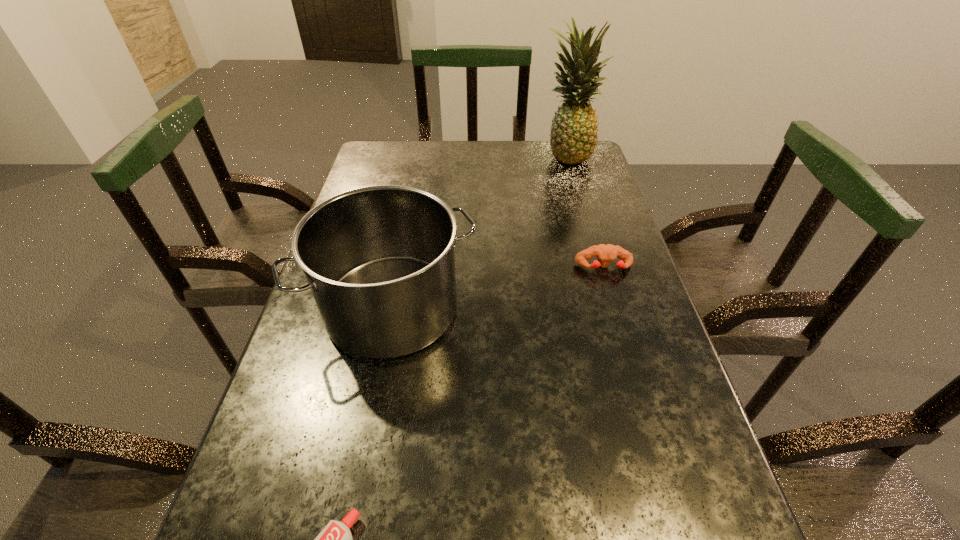
Find the location of a particular element. the tallest object is located at coordinates (573, 137).

Find the location of a particular element. Image resolution: width=960 pixels, height=540 pixels. pineapple is located at coordinates (573, 137).

Find the location of a particular element. The image size is (960, 540). the second tallest object is located at coordinates (379, 260).

This screenshot has width=960, height=540. In order to click on puncher in this screenshot , I will do `click(605, 253)`.

Identify the location of vacant space located on the left of the tallest object. Image resolution: width=960 pixels, height=540 pixels. (484, 156).

Where is `free space located 0.090m on the right of the second tallest object`? This screenshot has width=960, height=540. free space located 0.090m on the right of the second tallest object is located at coordinates (518, 309).

Find the location of a particular element. free space located with the gloves of the third tallest object facing forward is located at coordinates (611, 292).

Find the location of a particular element. object that is at the far edge is located at coordinates (573, 137).

Identify the location of object that is positioned at the left edge. Image resolution: width=960 pixels, height=540 pixels. (379, 260).

The image size is (960, 540). I want to click on pineapple that is at the right edge, so point(573,137).